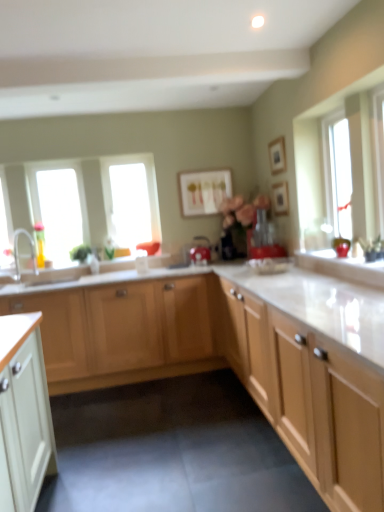
Question: Is matte red kettle at center, which appears as the 2th appliance when viewed from the right, positioned behind transparent glass window at center, which is counted as the 2th window, starting from the right?

Choices:
 (A) no
 (B) yes

Answer: (A)

Question: From the image's perspective, does matte red kettle at center, which is counted as the 1th appliance, starting from the back, appear higher than transparent glass window at center, the second window in the left-to-right sequence?

Choices:
 (A) yes
 (B) no

Answer: (B)

Question: Considering the relative sizes of matte red kettle at center, which is counted as the 1th appliance, starting from the back, and transparent glass window at center, the 3th window from the front, in the image provided, is matte red kettle at center, which is counted as the 1th appliance, starting from the back, shorter than transparent glass window at center, the 3th window from the front,?

Choices:
 (A) yes
 (B) no

Answer: (A)

Question: Is matte red kettle at center, which appears as the 2th appliance when viewed from the right, in front of transparent glass window at center, the 3th window from the front?

Choices:
 (A) no
 (B) yes

Answer: (B)

Question: Are matte red kettle at center, the second appliance in the front-to-back sequence, and transparent glass window at center, the second window in the left-to-right sequence, located far from each other?

Choices:
 (A) no
 (B) yes

Answer: (A)

Question: Considering the positions of point (279, 192) and point (125, 178), is point (279, 192) closer or farther from the camera than point (125, 178)?

Choices:
 (A) farther
 (B) closer

Answer: (B)

Question: In terms of height, does wooden picture frame at upper center, the third picture frame in the left-to-right sequence, look taller or shorter compared to transparent glass window at center, the second window in the left-to-right sequence?

Choices:
 (A) short
 (B) tall

Answer: (A)

Question: Based on their sizes in the image, would you say wooden picture frame at upper center, the 2th picture frame positioned from the back, is bigger or smaller than transparent glass window at center, positioned as the 1th window in back-to-front order?

Choices:
 (A) small
 (B) big

Answer: (A)

Question: Is wooden picture frame at upper center, which is the first picture frame in right-to-left order, wider or thinner than transparent glass window at center, which is counted as the 2th window, starting from the right?

Choices:
 (A) wide
 (B) thin

Answer: (B)

Question: From their relative heights in the image, would you say light wood cabinet at center, which is the 1th cabinetry from back to front, is taller or shorter than transparent glass window at left, acting as the 1th window starting from the left?

Choices:
 (A) tall
 (B) short

Answer: (B)

Question: From the image's perspective, is light wood cabinet at center, the 2th cabinetry viewed from the front, positioned above or below transparent glass window at left, acting as the 1th window starting from the left?

Choices:
 (A) below
 (B) above

Answer: (A)

Question: Is light wood cabinet at center, the 2th cabinetry viewed from the front, situated inside transparent glass window at left, acting as the 1th window starting from the left, or outside?

Choices:
 (A) inside
 (B) outside

Answer: (B)

Question: In the image, is light wood cabinet at center, the 2th cabinetry viewed from the front, positioned in front of or behind transparent glass window at left, which is counted as the 2th window, starting from the back?

Choices:
 (A) behind
 (B) front

Answer: (B)

Question: Would you say matte red blender at center, the first appliance in the right-to-left sequence, is to the left or to the right of light wood cabinet at center, the 2th cabinetry viewed from the front, in the picture?

Choices:
 (A) right
 (B) left

Answer: (A)

Question: From a real-world perspective, is matte red blender at center, the 2th appliance viewed from the back, positioned above or below light wood cabinet at center, the 2th cabinetry viewed from the front?

Choices:
 (A) below
 (B) above

Answer: (B)